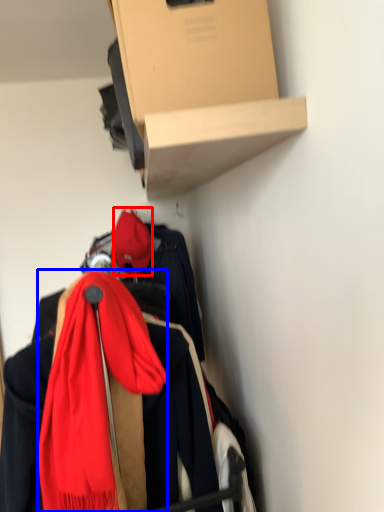
Question: Which object appears farthest to the camera in this image, hat (highlighted by a red box) or scarf (highlighted by a blue box)?

Choices:
 (A) hat
 (B) scarf

Answer: (A)